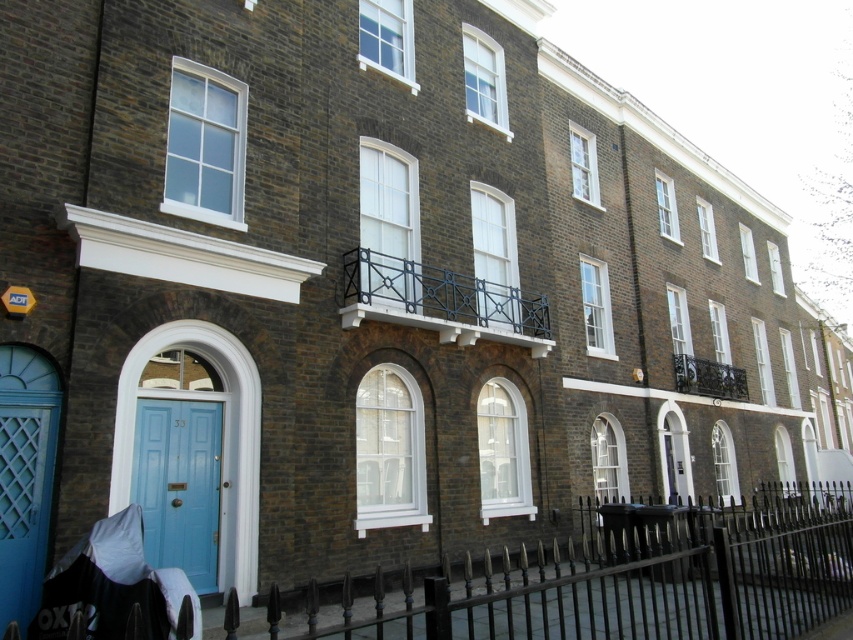
Question: Is black wrought iron fence at lower center to the right of black fabric baby carriage at lower left from the viewer's perspective?

Choices:
 (A) yes
 (B) no

Answer: (A)

Question: Is matte blue door at left in front of black fabric baby carriage at lower left?

Choices:
 (A) no
 (B) yes

Answer: (A)

Question: Estimate the real-world distances between objects in this image. Which object is farther from the matte blue door at left?

Choices:
 (A) black fabric baby carriage at lower left
 (B) black wrought iron fence at lower center

Answer: (B)

Question: Considering the real-world distances, which object is closest to the matte blue door at left?

Choices:
 (A) black fabric baby carriage at lower left
 (B) black wrought iron fence at lower center

Answer: (A)

Question: Which point is farther to the camera?

Choices:
 (A) pyautogui.click(x=387, y=588)
 (B) pyautogui.click(x=165, y=500)

Answer: (A)

Question: Observing the image, what is the correct spatial positioning of matte blue door at left in reference to black fabric baby carriage at lower left?

Choices:
 (A) left
 (B) right

Answer: (A)